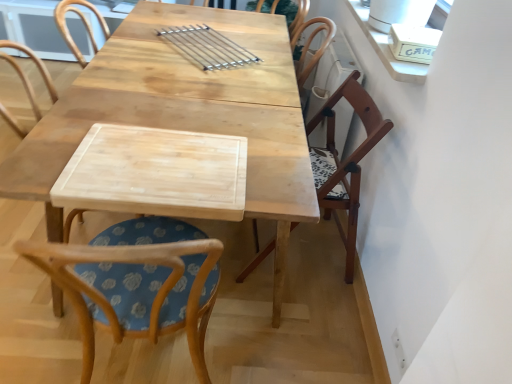
Question: Is wooden chair at right, which ranks as the 2th chair in left-to-right order, positioned with its back to wooden chair with floral cushion at center, the first chair positioned from the left?

Choices:
 (A) yes
 (B) no

Answer: (B)

Question: Can you confirm if wooden chair at right, which ranks as the 2th chair in left-to-right order, is bigger than wooden chair with floral cushion at center, arranged as the second chair when viewed from the right?

Choices:
 (A) no
 (B) yes

Answer: (A)

Question: From a real-world perspective, does wooden chair at right, which ranks as the 2th chair in left-to-right order, stand above wooden chair with floral cushion at center, the first chair positioned from the left?

Choices:
 (A) no
 (B) yes

Answer: (A)

Question: From the image's perspective, is wooden chair at right, which ranks as the 2th chair in left-to-right order, over wooden chair with floral cushion at center, arranged as the second chair when viewed from the right?

Choices:
 (A) yes
 (B) no

Answer: (A)

Question: From a real-world perspective, is wooden chair at right, which appears as the 1th chair when viewed from the right, positioned under wooden chair with floral cushion at center, the first chair positioned from the left, based on gravity?

Choices:
 (A) no
 (B) yes

Answer: (B)

Question: From a real-world perspective, is wooden chair at right, which ranks as the 2th chair in left-to-right order, positioned above or below wooden chair with floral cushion at center, arranged as the second chair when viewed from the right?

Choices:
 (A) below
 (B) above

Answer: (A)

Question: From the image's perspective, is wooden chair at right, which ranks as the 2th chair in left-to-right order, positioned above or below wooden chair with floral cushion at center, arranged as the second chair when viewed from the right?

Choices:
 (A) below
 (B) above

Answer: (B)

Question: Visually, is wooden chair at right, which ranks as the 2th chair in left-to-right order, positioned to the left or to the right of wooden chair with floral cushion at center, the first chair positioned from the left?

Choices:
 (A) left
 (B) right

Answer: (B)

Question: Relative to wooden chair with floral cushion at center, arranged as the second chair when viewed from the right, is wooden chair at right, which appears as the 1th chair when viewed from the right, in front or behind?

Choices:
 (A) behind
 (B) front

Answer: (A)

Question: Considering the positions of wooden chair with floral cushion at center, the first chair positioned from the left, and natural wood table at center in the image, is wooden chair with floral cushion at center, the first chair positioned from the left, wider or thinner than natural wood table at center?

Choices:
 (A) thin
 (B) wide

Answer: (A)

Question: Is wooden chair with floral cushion at center, arranged as the second chair when viewed from the right, to the left or to the right of natural wood table at center in the image?

Choices:
 (A) right
 (B) left

Answer: (B)

Question: Choose the correct answer: Is wooden chair with floral cushion at center, the first chair positioned from the left, inside natural wood table at center or outside it?

Choices:
 (A) inside
 (B) outside

Answer: (A)

Question: From the image's perspective, is wooden chair with floral cushion at center, the first chair positioned from the left, located above or below natural wood table at center?

Choices:
 (A) below
 (B) above

Answer: (A)

Question: Is wooden chair at right, which appears as the 1th chair when viewed from the right, in front of or behind natural wood table at center in the image?

Choices:
 (A) behind
 (B) front

Answer: (A)

Question: From the image's perspective, is wooden chair at right, which ranks as the 2th chair in left-to-right order, located above or below natural wood table at center?

Choices:
 (A) above
 (B) below

Answer: (B)